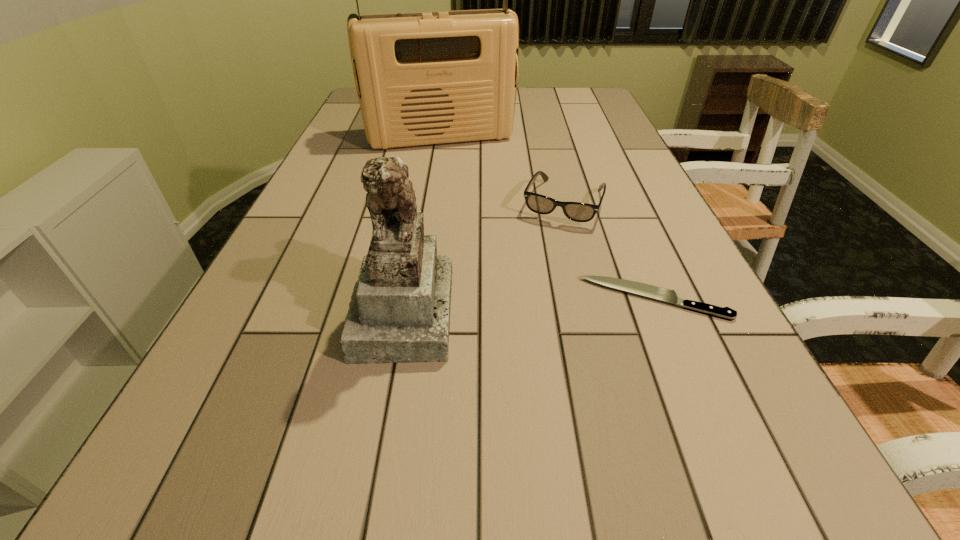
You are a GUI agent. You are given a task and a screenshot of the screen. Output one action in this format:
    pyautogui.click(x=<x>, y=<y>)
    Task: Click on the figurine
    Image resolution: width=960 pixels, height=540 pixels.
    Given the screenshot: What is the action you would take?
    pyautogui.click(x=400, y=312)

In order to click on steak knife in this screenshot , I will do `click(671, 296)`.

The width and height of the screenshot is (960, 540). I want to click on the farthest object, so click(422, 78).

Identify the location of radio receiver. This screenshot has width=960, height=540. (422, 78).

The width and height of the screenshot is (960, 540). I want to click on the second farthest object, so click(579, 212).

What are the coordinates of `spectacles` in the screenshot? It's located at (579, 212).

The width and height of the screenshot is (960, 540). In order to click on vacant region located on the front-facing side of the second tallest object in this screenshot , I will do `click(635, 311)`.

Locate an element on the screen. This screenshot has height=540, width=960. vacant space located 0.230m on the back of the shortest object is located at coordinates (618, 214).

Identify the location of free space located on the front-facing side of the farthest object. [480, 229].

Where is `blank area located on the front-facing side of the farthest object`? The image size is (960, 540). blank area located on the front-facing side of the farthest object is located at coordinates point(470,201).